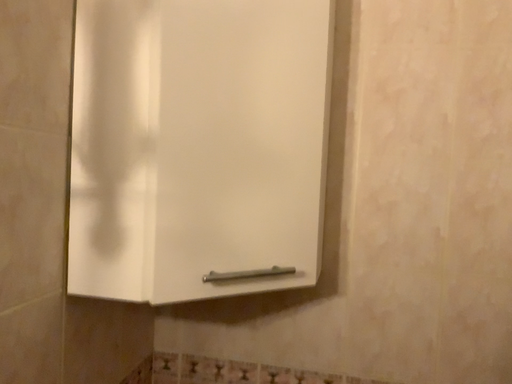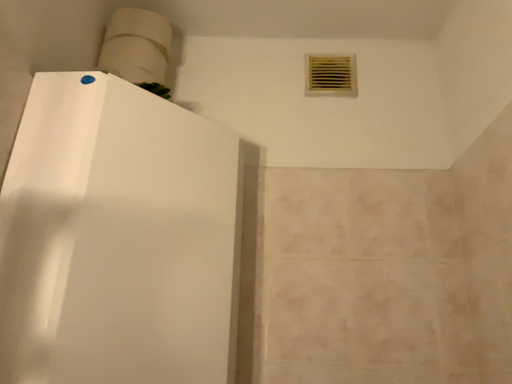
Question: How did the camera likely rotate when shooting the video?

Choices:
 (A) rotated right
 (B) rotated left

Answer: (A)